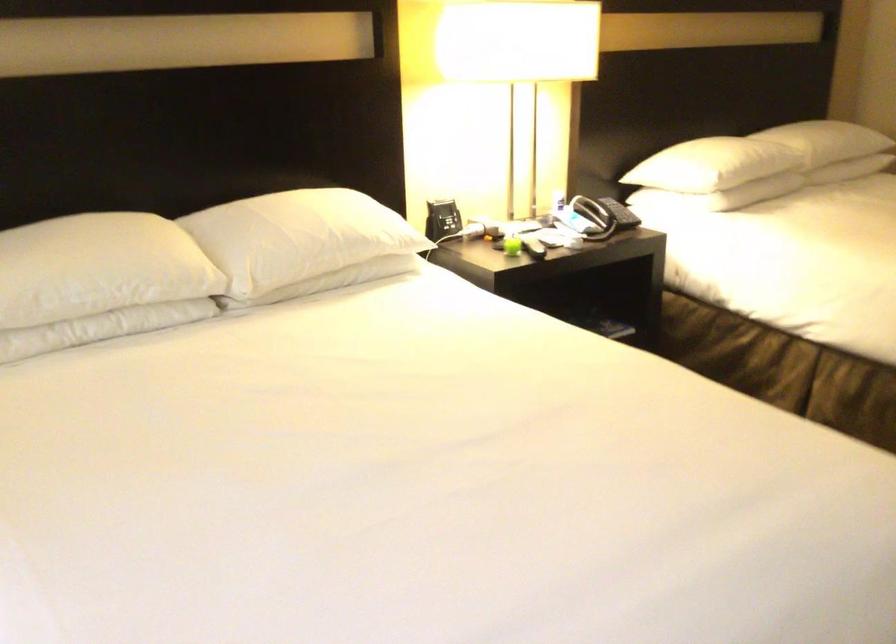
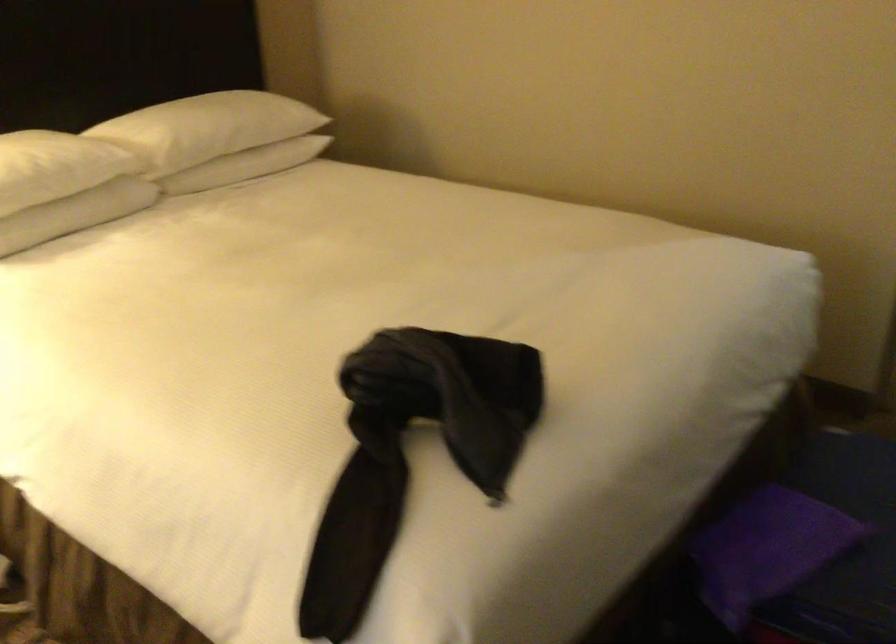
In a continuous first-person perspective shot, in which direction is the camera moving?

The cameraman walked toward right, forward.